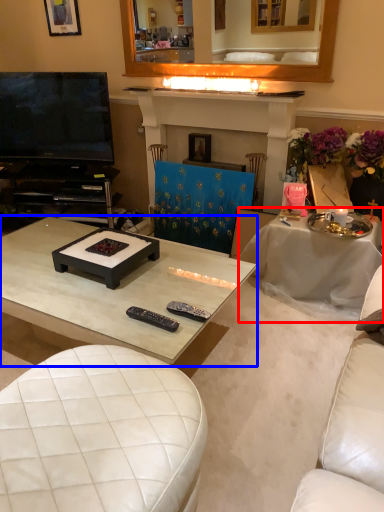
Question: Which object appears closest to the camera in this image, table (highlighted by a red box) or coffee table (highlighted by a blue box)?

Choices:
 (A) table
 (B) coffee table

Answer: (B)